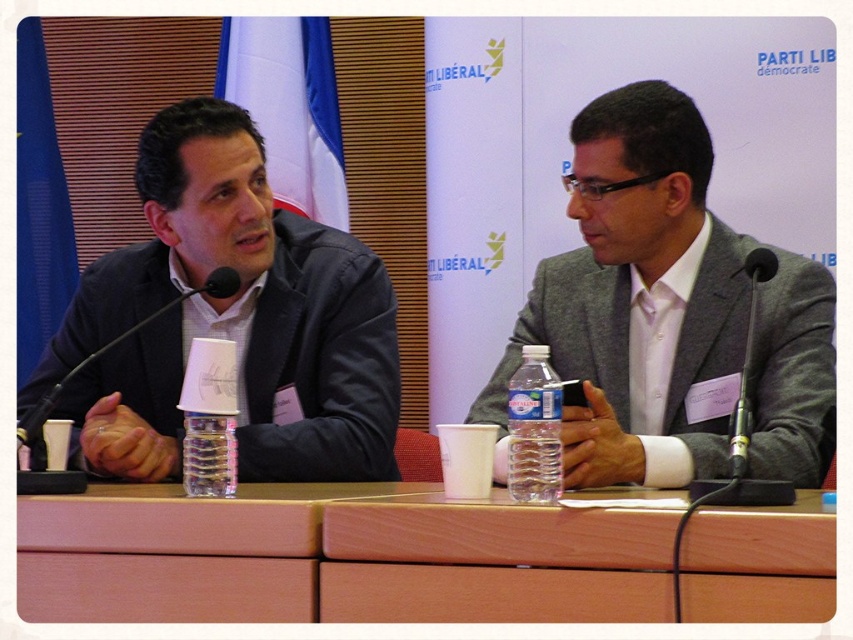
Question: Which point is farther to the camera?

Choices:
 (A) black matte microphone at left
 (B) wooden table at center
 (C) clear plastic bottle at center
 (D) matte black suit at left

Answer: (D)

Question: Is clear plastic bottle at center further to the viewer compared to black matte microphone at left?

Choices:
 (A) no
 (B) yes

Answer: (A)

Question: Where is wooden table at center located in relation to black matte microphone at left in the image?

Choices:
 (A) above
 (B) below

Answer: (B)

Question: Which point is farther from the camera taking this photo?

Choices:
 (A) (250, 477)
 (B) (537, 365)
 (C) (103, 560)

Answer: (A)

Question: Among these objects, which one is farthest from the camera?

Choices:
 (A) gray fabric suit at center
 (B) wooden table at center

Answer: (A)

Question: Considering the relative positions of matte black suit at left and clear plastic bottle at center in the image provided, where is matte black suit at left located with respect to clear plastic bottle at center?

Choices:
 (A) right
 (B) left

Answer: (B)